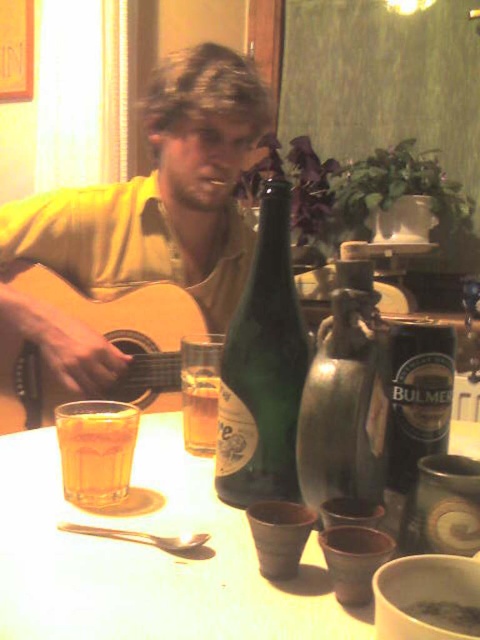
Can you confirm if metallic silver jug at center is positioned above matte wood guitar at left?

No, metallic silver jug at center is not above matte wood guitar at left.

Who is shorter, metallic silver jug at center or matte wood guitar at left?

metallic silver jug at center is shorter.

This screenshot has height=640, width=480. Find the location of `metallic silver jug at center`. metallic silver jug at center is located at coordinates (345, 397).

You are a GUI agent. You are given a task and a screenshot of the screen. Output one action in this format:
    pyautogui.click(x=<x>, y=<y>)
    Task: Click on the metallic silver jug at center
    
    Given the screenshot: What is the action you would take?
    pyautogui.click(x=345, y=397)

Does green glass bottle at center have a lesser width compared to matte wood guitar at left?

Correct, green glass bottle at center's width is less than matte wood guitar at left's.

Can you confirm if green glass bottle at center is smaller than matte wood guitar at left?

Correct, green glass bottle at center occupies less space than matte wood guitar at left.

Identify the location of green glass bottle at center. The image size is (480, 640). (263, 369).

Does matte glass cup at lower left have a smaller size compared to green glass bottle at center?

No.

Is point (204, 600) farther from camera compared to point (228, 410)?

No, it is not.

Where is `matte glass cup at lower left`? This screenshot has height=640, width=480. matte glass cup at lower left is located at coordinates [x=146, y=557].